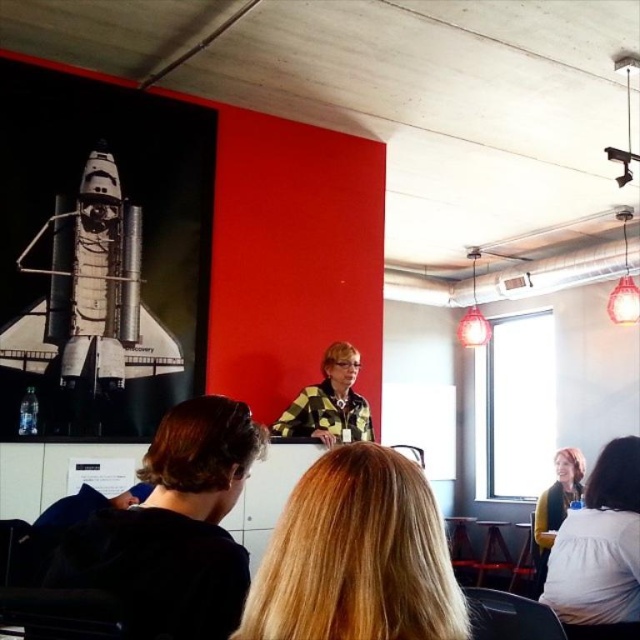
You are standing at the center of the room and want to place a small plant on the floor near the black fabric at lower left. Based on the coordinates provided, where should you place the plant relative to the room?

The black fabric at lower left is located at coordinates point (173, 529). To place the plant near it, position it close to those coordinates, which would be towards the lower left corner of the room.

Looking at this image, you are sitting in the front row of the room and notice both the metallic silver rocket at upper left and the matte white shirt at lower right. Which object is positioned to the left when viewed from your perspective?

The metallic silver rocket at upper left is positioned to the left of the matte white shirt at lower right from your perspective.